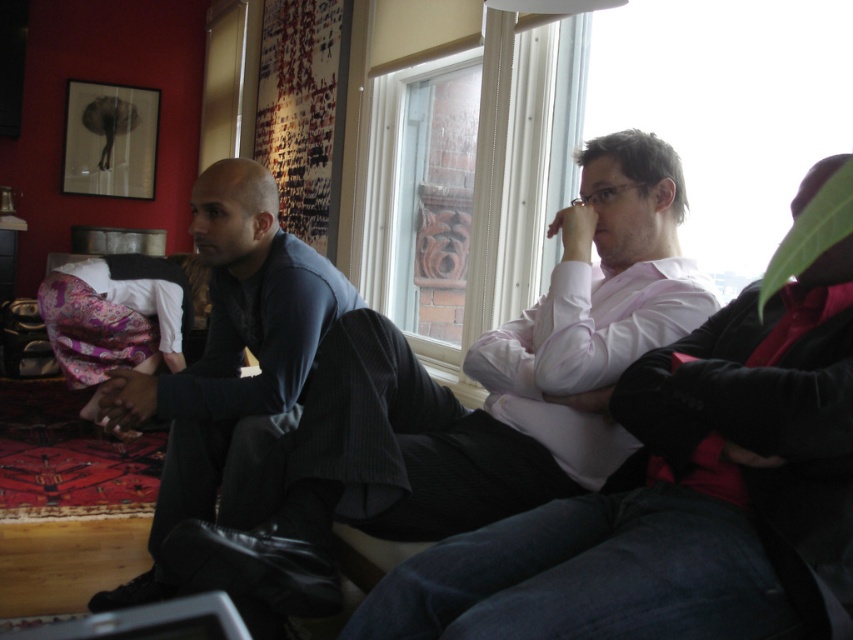
Question: Which of the following is the farthest from the observer?

Choices:
 (A) clear glass window at center
 (B) dark blue shirt at left

Answer: (A)

Question: Among these points, which one is farthest from the camera?

Choices:
 (A) (201, 212)
 (B) (381, 305)
 (C) (630, 248)

Answer: (B)

Question: Does dark blue shirt at left have a lesser width compared to clear glass window at center?

Choices:
 (A) yes
 (B) no

Answer: (B)

Question: Which point is farther to the camera?

Choices:
 (A) (154, 515)
 (B) (663, 273)
 (C) (379, 182)

Answer: (C)

Question: Is dark blue sweater at center further to camera compared to clear glass window at center?

Choices:
 (A) yes
 (B) no

Answer: (B)

Question: Does dark blue sweater at center appear on the left side of clear glass window at center?

Choices:
 (A) no
 (B) yes

Answer: (A)